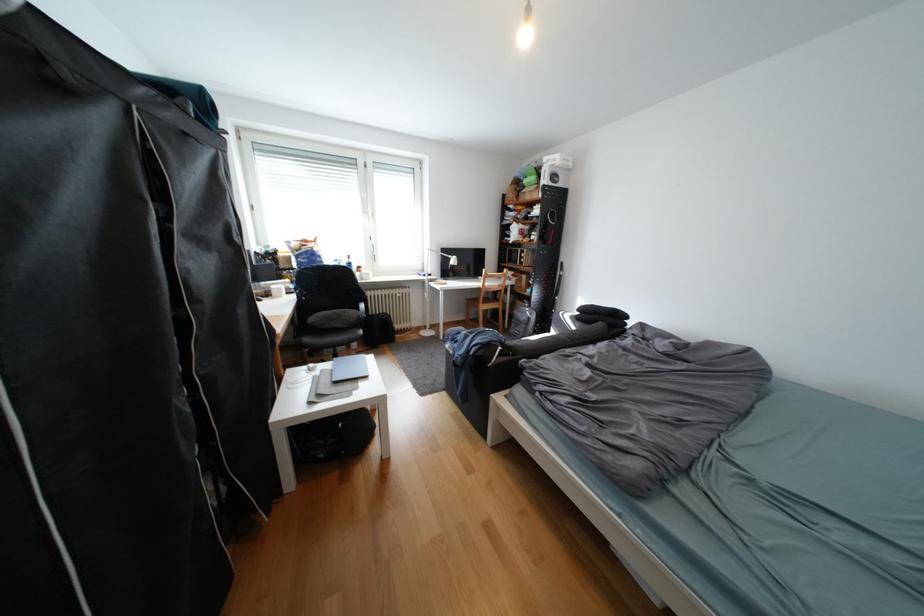
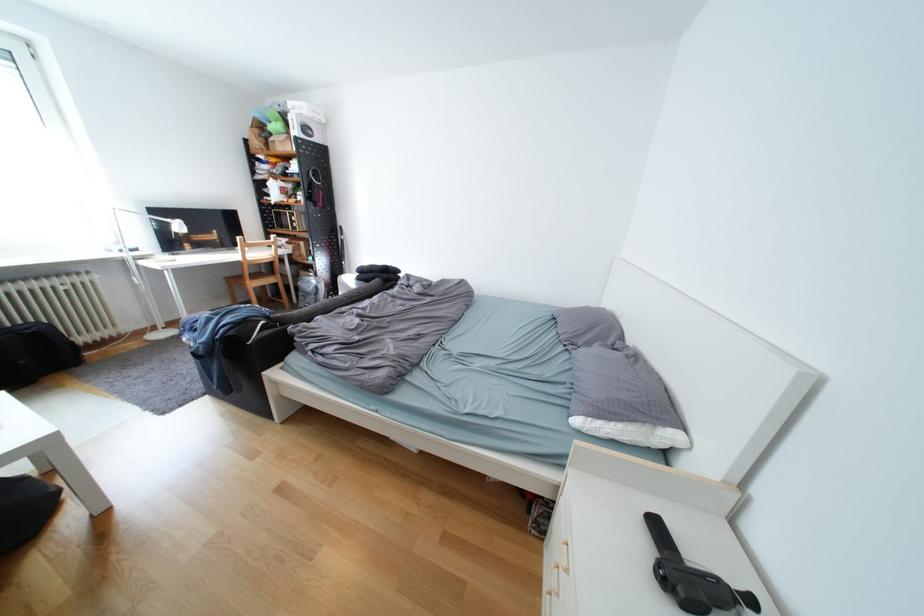
The point at [527,321] is marked in the first image. Where is the corresponding point in the second image?

(313, 294)